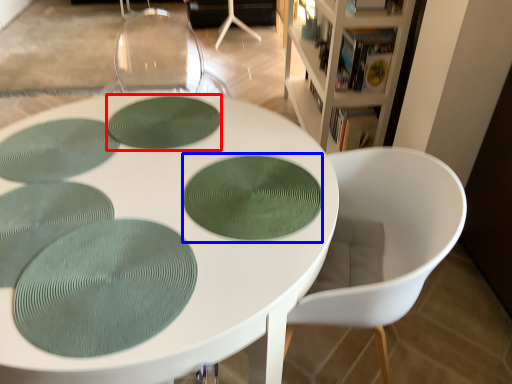
Question: Which of the following is the closest to the observer, oval (highlighted by a red box) or oval (highlighted by a blue box)?

Choices:
 (A) oval
 (B) oval

Answer: (B)